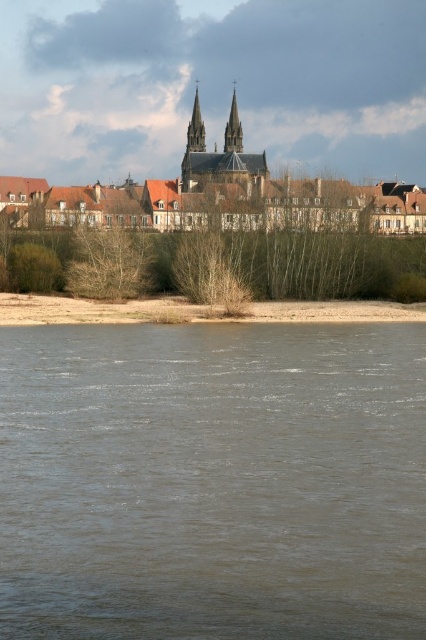
Which of these two, smooth stone spire at center or smooth gray stone spire at center, stands shorter?

Standing shorter between the two is smooth gray stone spire at center.

Locate an element on the screen. The height and width of the screenshot is (640, 426). smooth stone spire at center is located at coordinates 195,128.

Image resolution: width=426 pixels, height=640 pixels. Find the location of `smooth stone spire at center`. smooth stone spire at center is located at coordinates pyautogui.click(x=195, y=128).

Does brown tiled roofs at center appear under smooth gray stone spire at center?

Correct, brown tiled roofs at center is located below smooth gray stone spire at center.

Is point (296, 202) closer to camera compared to point (233, 90)?

Yes, it is.

Describe the element at coordinates (218, 204) in the screenshot. I see `brown tiled roofs at center` at that location.

Locate an element on the screen. The image size is (426, 640). brown tiled roofs at center is located at coordinates (218, 204).

Between brown muddy water at lower center and smooth stone spire at center, which one appears on the left side from the viewer's perspective?

From the viewer's perspective, smooth stone spire at center appears more on the left side.

Does brown muddy water at lower center have a greater width compared to smooth stone spire at center?

Indeed, brown muddy water at lower center has a greater width compared to smooth stone spire at center.

In the scene shown: Who is more distant from viewer, (391, 492) or (192, 148)?

The point (192, 148) is behind.

Where is `brown muddy water at lower center`? brown muddy water at lower center is located at coordinates (213, 481).